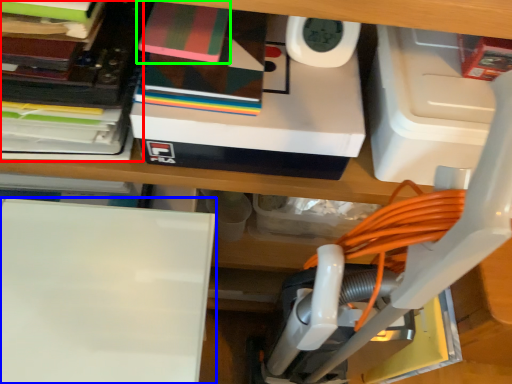
Question: Which is nearer to the book (highlighted by a red box)? wide (highlighted by a blue box) or paperback book (highlighted by a green box).

Choices:
 (A) wide
 (B) paperback book

Answer: (B)